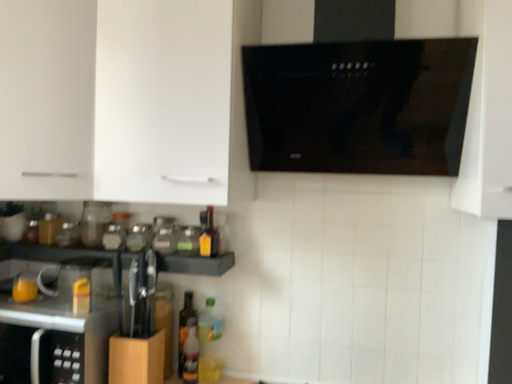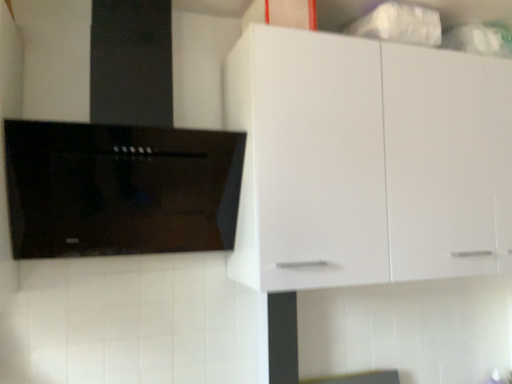
Question: Which way did the camera rotate in the video?

Choices:
 (A) rotated left
 (B) rotated right

Answer: (B)